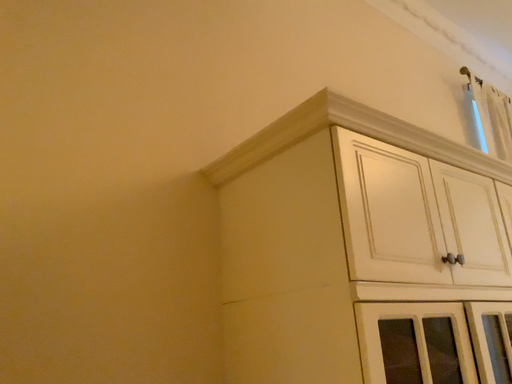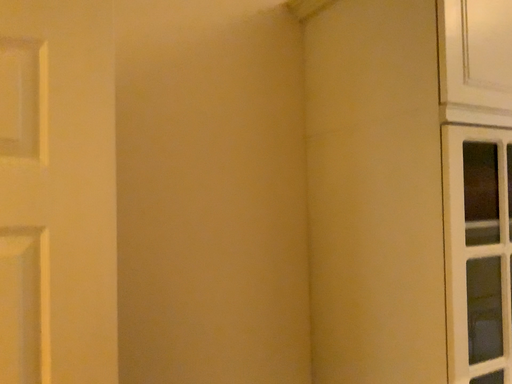
Question: How did the camera likely rotate when shooting the video?

Choices:
 (A) rotated upward
 (B) rotated downward

Answer: (B)